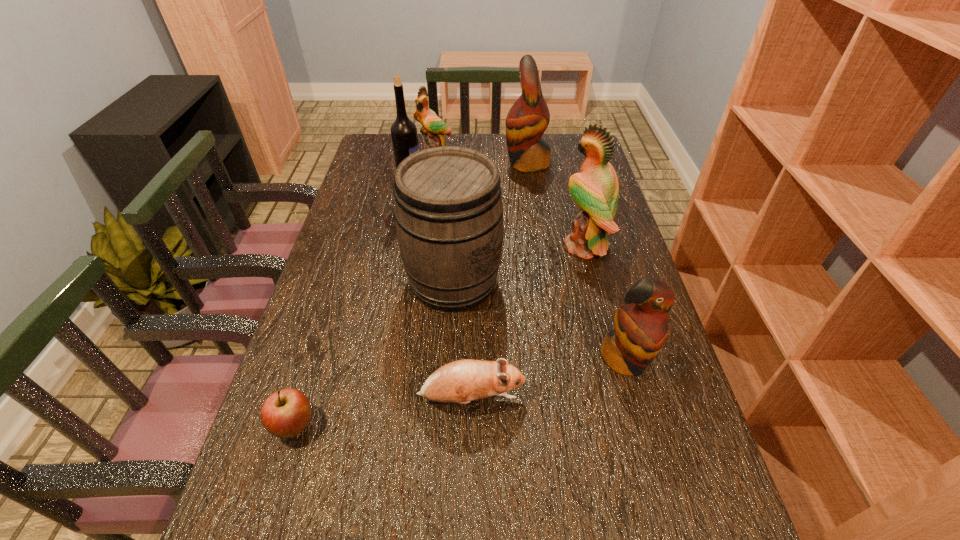
Identify the location of the right red parrot. The height and width of the screenshot is (540, 960). (640, 331).

Where is `hamster`? This screenshot has height=540, width=960. hamster is located at coordinates (x=462, y=381).

You are a GUI agent. You are given a task and a screenshot of the screen. Output one action in this format:
    pyautogui.click(x=<x>, y=<y>)
    Task: Click on the red apple
    This screenshot has height=540, width=960.
    Given the screenshot: What is the action you would take?
    pyautogui.click(x=285, y=413)

Identify the location of the leftmost object. The height and width of the screenshot is (540, 960). (285, 413).

The width and height of the screenshot is (960, 540). Find the location of `free space located on the label of the wine bottle`. free space located on the label of the wine bottle is located at coordinates (513, 197).

You are a GUI agent. You are given a task and a screenshot of the screen. Output one action in this format:
    pyautogui.click(x=<x>, y=<y>)
    Task: Click on the blank area located on the face of the bigger red parrot
    The image size is (960, 540).
    Given the screenshot: What is the action you would take?
    pyautogui.click(x=426, y=163)

What are the coordinates of `vacant area situated 0.120m on the face of the bigger red parrot` in the screenshot? It's located at (470, 163).

Image resolution: width=960 pixels, height=540 pixels. In order to click on vacant region located 0.330m on the face of the bigger red parrot in this screenshot , I will do `click(413, 163)`.

Image resolution: width=960 pixels, height=540 pixels. Identify the location of vacant region located 0.350m on the front-facing side of the nearer green parrot. (439, 246).

Find the location of `free space located 0.100m on the front-facing side of the nearer green parrot`. free space located 0.100m on the front-facing side of the nearer green parrot is located at coordinates (525, 246).